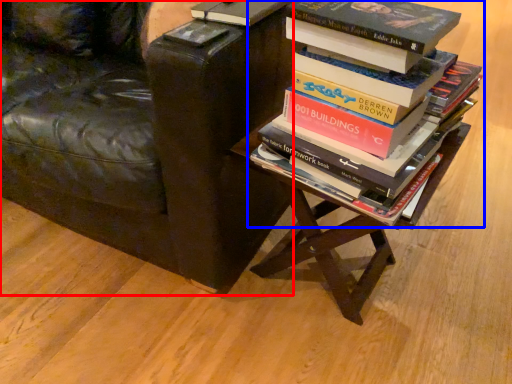
Question: Which point is closer to the camera, chair (highlighted by a red box) or book (highlighted by a blue box)?

Choices:
 (A) chair
 (B) book

Answer: (B)